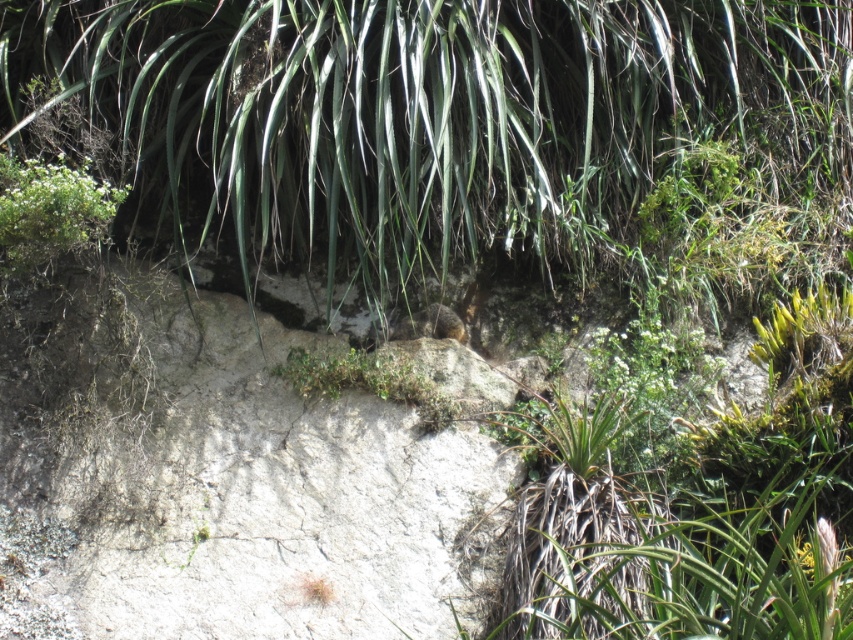
Question: Can you confirm if green leafy plant at upper center is bigger than green leafy plant at upper left?

Choices:
 (A) yes
 (B) no

Answer: (A)

Question: Does green leafy plant at upper center have a lesser width compared to green leafy plant at upper left?

Choices:
 (A) no
 (B) yes

Answer: (A)

Question: Which object is farther from the camera taking this photo?

Choices:
 (A) green leafy plant at upper left
 (B) green leafy plant at upper center

Answer: (B)

Question: Is green leafy plant at upper center smaller than green leafy plant at upper left?

Choices:
 (A) yes
 (B) no

Answer: (B)

Question: Among these objects, which one is farthest from the camera?

Choices:
 (A) green leafy plant at upper left
 (B) green leafy plant at upper center

Answer: (B)